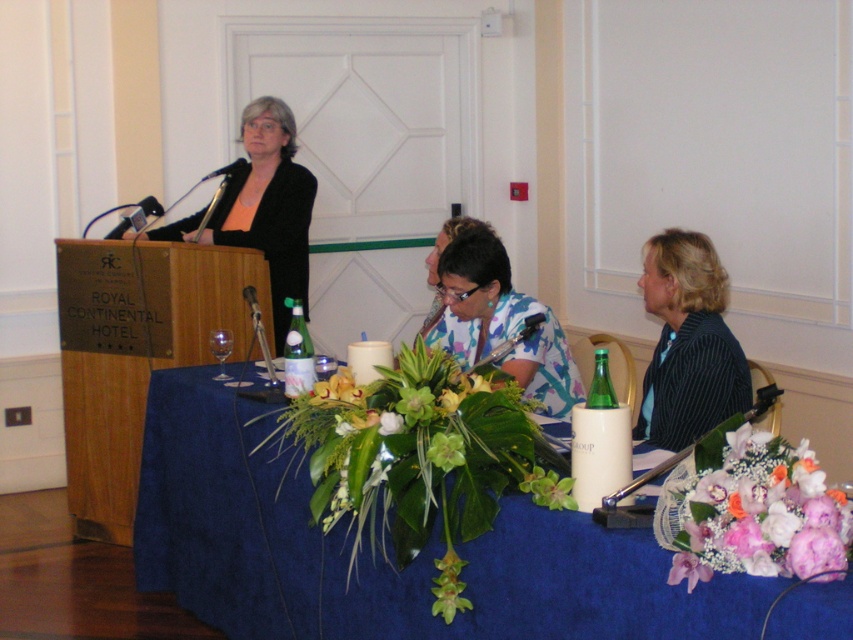
Question: Does green leafy plant at center have a larger size compared to matte black blazer at center?

Choices:
 (A) yes
 (B) no

Answer: (B)

Question: Which object is positioned farthest from the black pinstripe blazer at right?

Choices:
 (A) blue fabric table at center
 (B) floral print shirt at center
 (C) green leafy plant at center
 (D) purple silk flowers at center

Answer: (A)

Question: In this image, where is green leafy plant at center located relative to purple silk flowers at center?

Choices:
 (A) above
 (B) below

Answer: (B)

Question: Which object is positioned farthest from the green leafy plant at center?

Choices:
 (A) blue fabric table at center
 (B) matte black blazer at center

Answer: (B)

Question: Considering the real-world distances, which object is farthest from the matte black blazer at center?

Choices:
 (A) purple silk flowers at center
 (B) black pinstripe blazer at right
 (C) blue fabric table at center

Answer: (A)

Question: Is the position of blue fabric table at center less distant than that of green leafy plant at center?

Choices:
 (A) no
 (B) yes

Answer: (B)